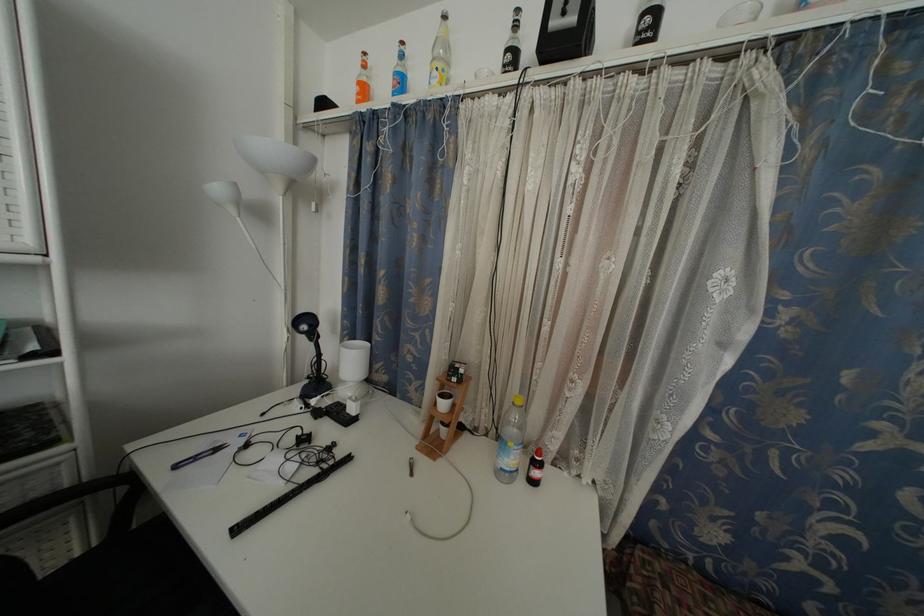
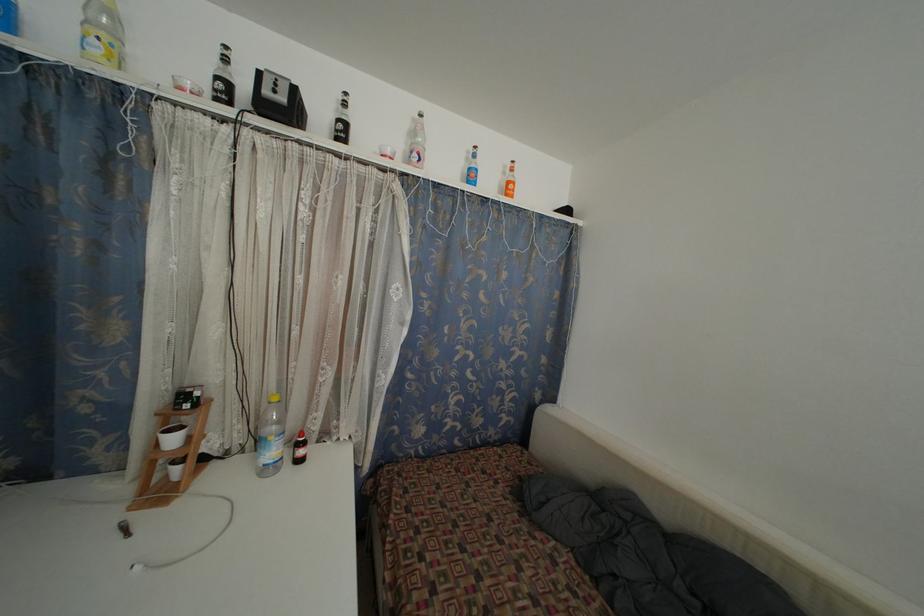
Find the pixel in the second image that matches (447,411) in the first image.

(176, 446)